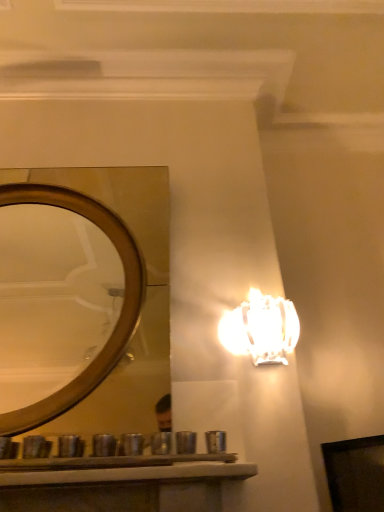
Question: Considering the relative positions of white glossy lamp at upper right and wooden mirror at center in the image provided, is white glossy lamp at upper right in front of wooden mirror at center?

Choices:
 (A) no
 (B) yes

Answer: (A)

Question: Does white glossy lamp at upper right have a lesser height compared to wooden mirror at center?

Choices:
 (A) no
 (B) yes

Answer: (B)

Question: Considering the relative sizes of white glossy lamp at upper right and wooden mirror at center in the image provided, is white glossy lamp at upper right thinner than wooden mirror at center?

Choices:
 (A) yes
 (B) no

Answer: (A)

Question: Is white glossy lamp at upper right not close to wooden mirror at center?

Choices:
 (A) yes
 (B) no

Answer: (A)

Question: Is white glossy lamp at upper right bigger than wooden mirror at center?

Choices:
 (A) yes
 (B) no

Answer: (B)

Question: From the image's perspective, would you say white glossy lamp at upper right is positioned over wooden mirror at center?

Choices:
 (A) no
 (B) yes

Answer: (A)

Question: From the image's perspective, would you say wooden mirror at center is positioned over white glossy lamp at upper right?

Choices:
 (A) yes
 (B) no

Answer: (A)

Question: Is the depth of wooden mirror at center less than that of white glossy lamp at upper right?

Choices:
 (A) yes
 (B) no

Answer: (A)

Question: From the image's perspective, is wooden mirror at center located beneath white glossy lamp at upper right?

Choices:
 (A) yes
 (B) no

Answer: (B)

Question: Is white glossy lamp at upper right completely or partially inside wooden mirror at center?

Choices:
 (A) yes
 (B) no

Answer: (B)

Question: Is wooden mirror at center placed right next to white glossy lamp at upper right?

Choices:
 (A) yes
 (B) no

Answer: (B)

Question: Is wooden mirror at center positioned with its back to white glossy lamp at upper right?

Choices:
 (A) yes
 (B) no

Answer: (B)

Question: In terms of width, does wooden mirror at center look wider or thinner when compared to white glossy lamp at upper right?

Choices:
 (A) wide
 (B) thin

Answer: (A)